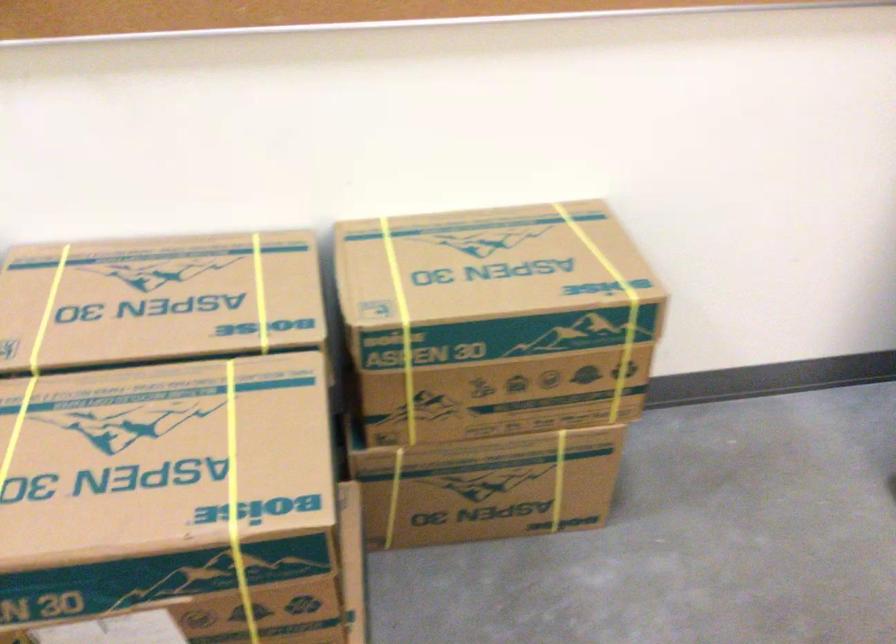
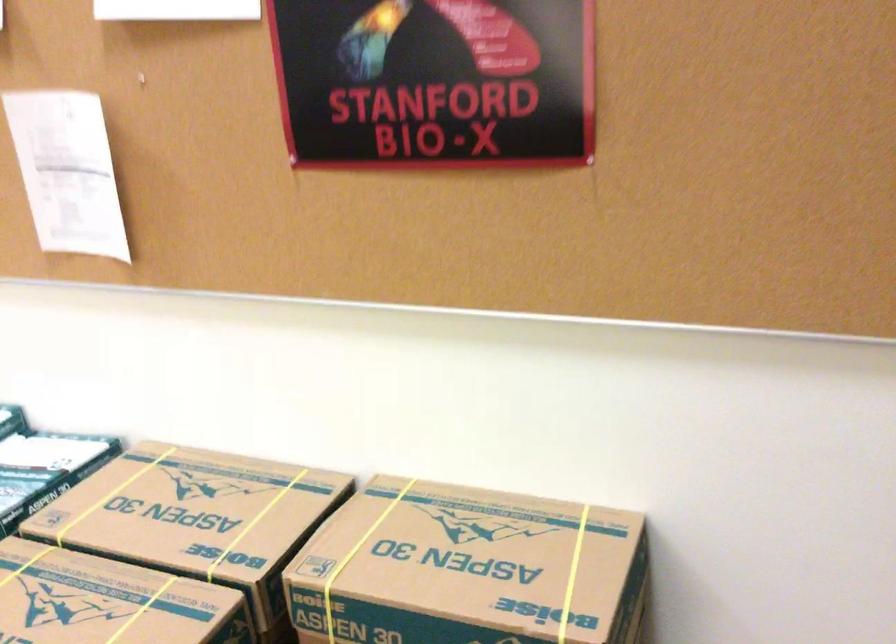
Find the pixel in the second image that matches point 409,290 in the first image.

(357, 556)